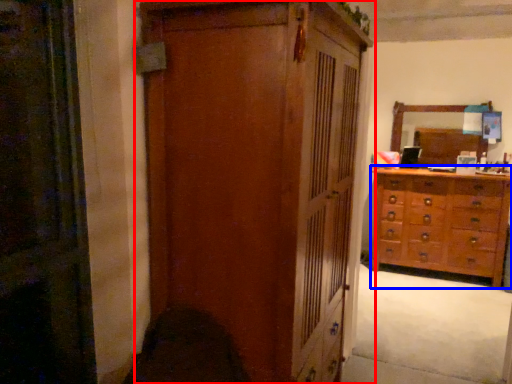
Question: Which object is further to the camera taking this photo, cupboard (highlighted by a red box) or chest of drawers (highlighted by a blue box)?

Choices:
 (A) cupboard
 (B) chest of drawers

Answer: (B)